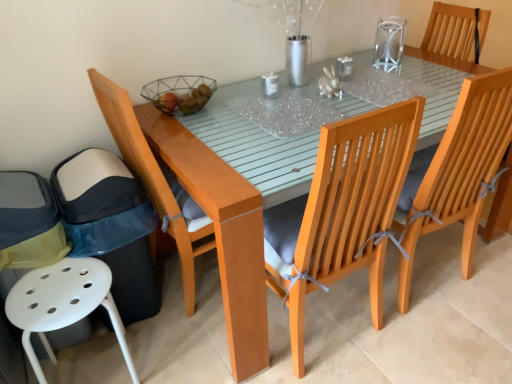
This screenshot has height=384, width=512. In order to click on vacant space in between wire mesh basket at center and transparent plastic table at center, the second glass table viewed from the right in this screenshot , I will do `click(226, 115)`.